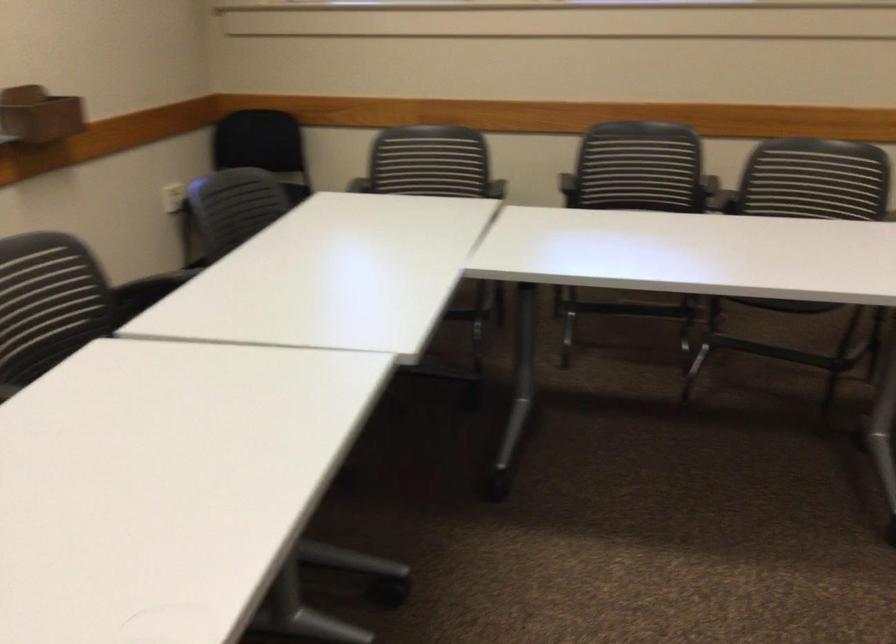
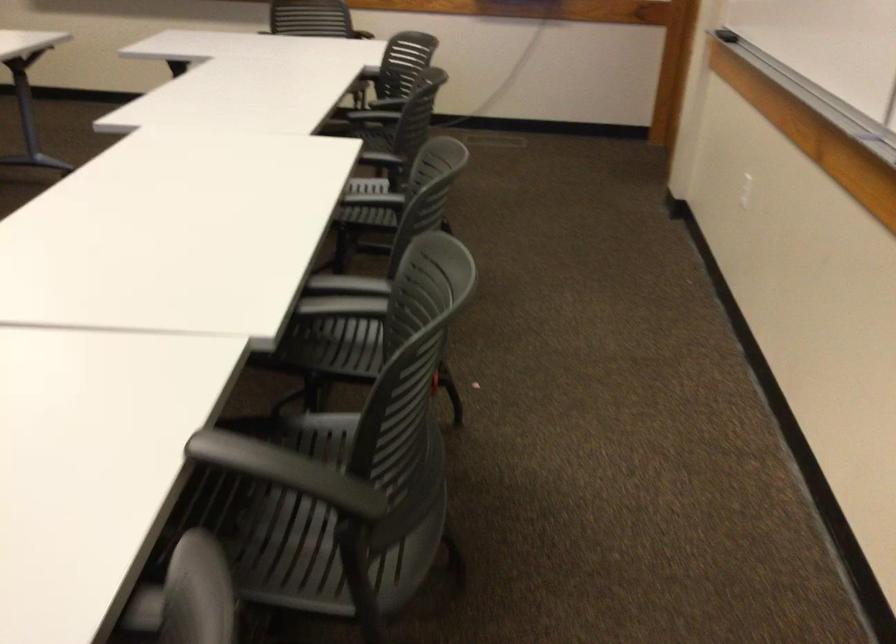
Where in the second image is the point corresponding to (117,286) from the first image?

(286, 471)